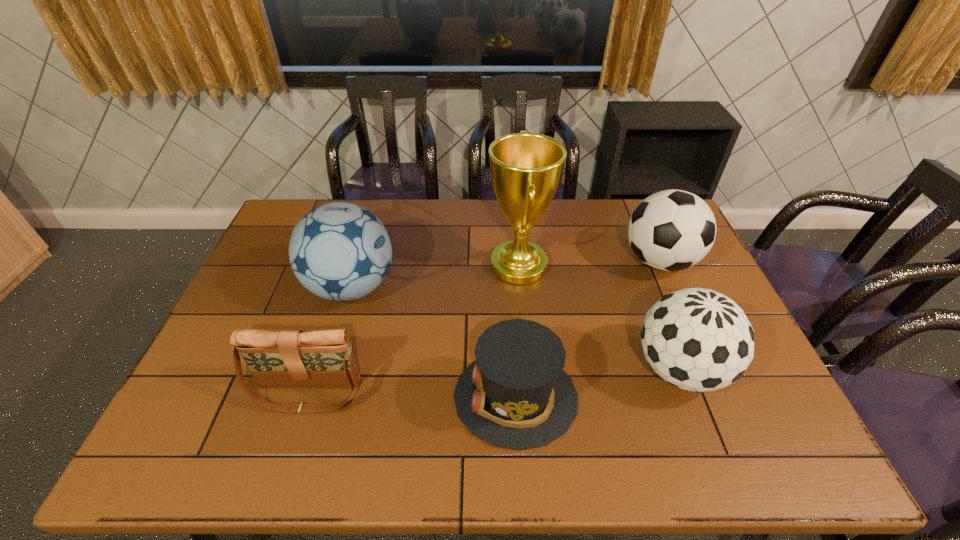
In the image, there is a desktop. Identify the location of vacant space at the near edge. This screenshot has width=960, height=540. (427, 460).

Identify the location of free spot at the left edge of the desktop. This screenshot has width=960, height=540. (239, 428).

The image size is (960, 540). Identify the location of free space between the tallest object and the leftmost soccer ball. point(435,276).

Find the location of `empty location between the dress hat and the nearest soccer ball`. empty location between the dress hat and the nearest soccer ball is located at coordinates (597, 383).

What are the coordinates of `object that is the fourth closest to the shoulder bag` in the screenshot? It's located at (697, 339).

Where is `the closest object to the leftmost soccer ball`? This screenshot has width=960, height=540. the closest object to the leftmost soccer ball is located at coordinates (287, 358).

Identify which soccer ball is the closest to the leftmost soccer ball. Please provide its 2D coordinates. Your answer should be formatted as a tuple, i.e. [(x, y)], where the tuple contains the x and y coordinates of a point satisfying the conditions above.

[(697, 339)]

Locate an element on the screen. The image size is (960, 540). soccer ball that is the closest to the tallest object is located at coordinates (697, 339).

Where is `free point that satisfies the following two spatial constraints: 1. on the side with brand of the leftmost soccer ball; 2. on the left side of the nearest soccer ball`? free point that satisfies the following two spatial constraints: 1. on the side with brand of the leftmost soccer ball; 2. on the left side of the nearest soccer ball is located at coordinates (327, 369).

I want to click on vacant point that satisfies the following two spatial constraints: 1. by the handles of the nearest soccer ball; 2. on the left side of the award, so click(x=528, y=369).